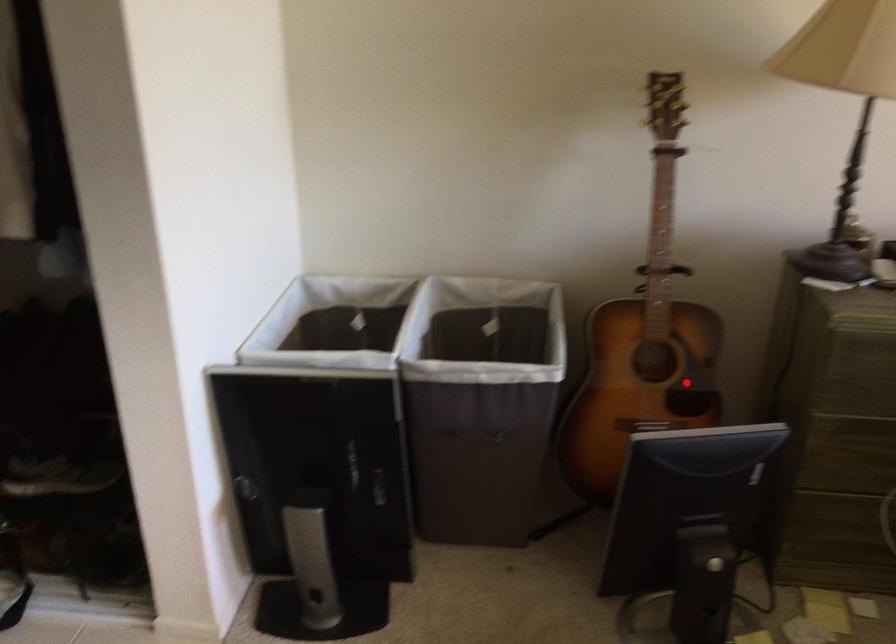
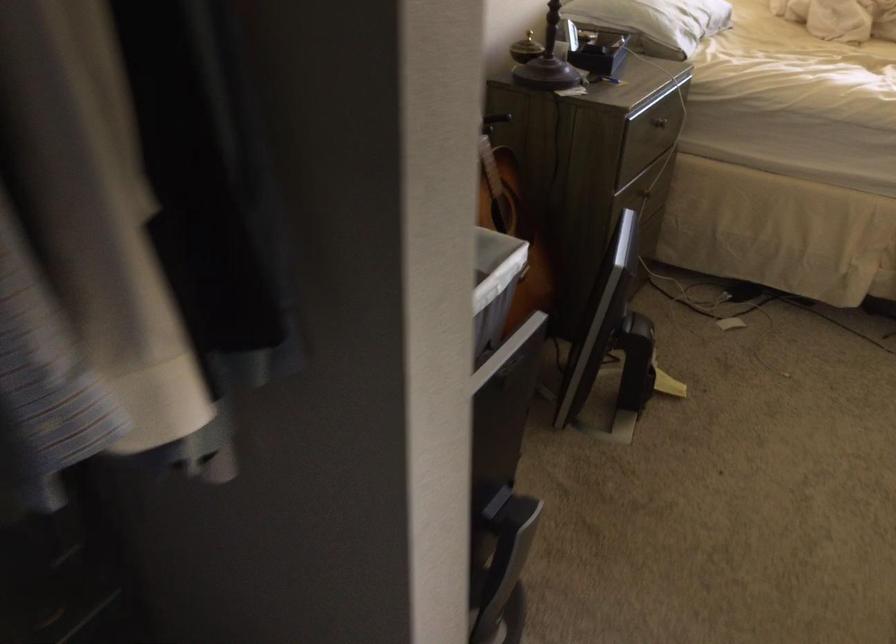
Where in the second image is the point corresponding to the highlighted location from the first image?

(513, 227)